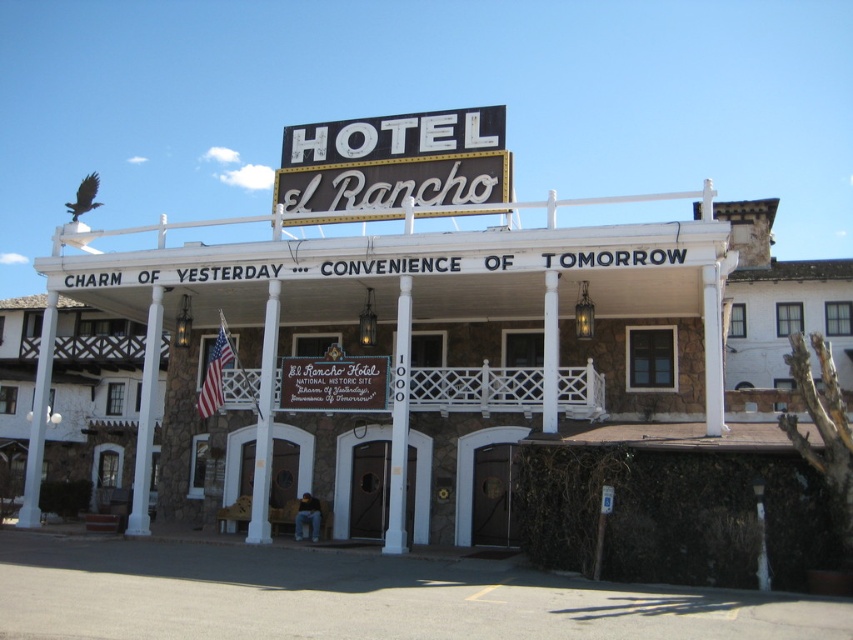
You are a hotel guest standing at the entrance of El Rancho Hotel. You notice a metallic gold sign at center and a white painted wood pillar at center. If you want to move from the entrance to the pillar, will you pass by the sign first?

The distance between the metallic gold sign at center and the white painted wood pillar at center is 14.37 meters. Since the sign is closer to the entrance than the pillar, you will pass by the metallic gold sign at center first before reaching the white painted wood pillar at center.

You are standing in front of the El Rancho Hotel and notice a brown wooden sign at center. Where exactly is this sign positioned relative to the main entrance?

The brown wooden sign at center is located at point coordinates (334,381), which places it near the central area of the hotel facade, likely above or near the main entrance.

You are standing at the entrance of El Rancho Hotel and want to reach the brown wooden sign at center. The hotel has a strict rule that guests must stay at least 150 feet away from the sign to preserve its historical integrity. Are you currently violating this rule?

The distance between you and the brown wooden sign at center is 162.49 feet, which is more than the required 150 feet. Therefore, you are not violating the rule.